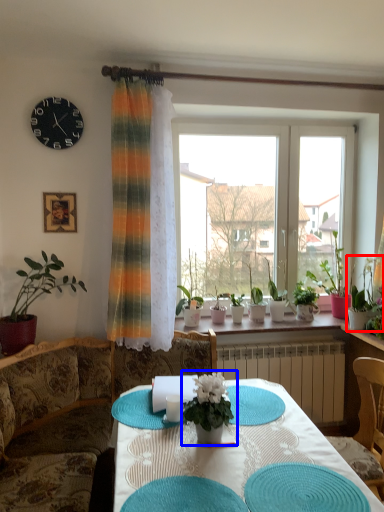
Question: Which object is closer to the camera taking this photo, houseplant (highlighted by a red box) or houseplant (highlighted by a blue box)?

Choices:
 (A) houseplant
 (B) houseplant

Answer: (B)